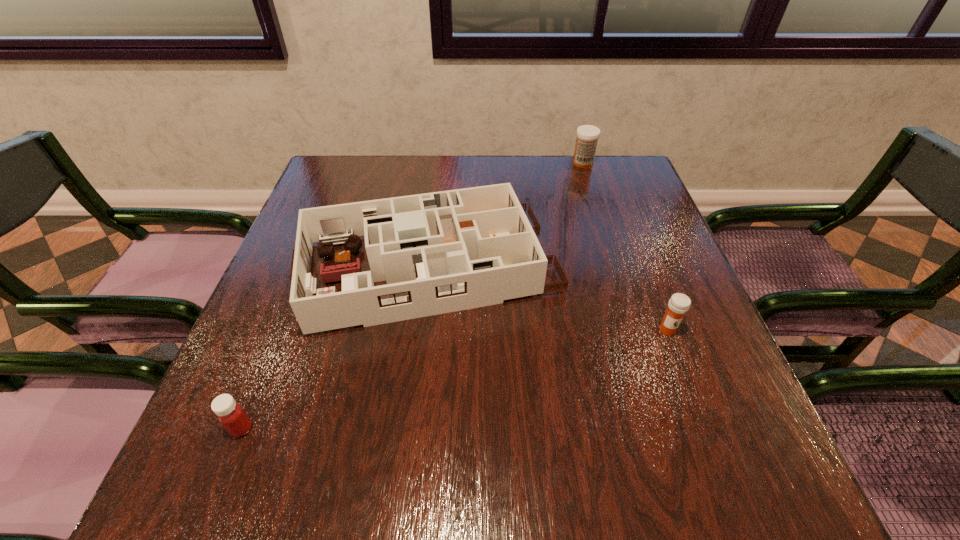
Point out which medicine is positioned as the second nearest to the rightmost medicine. Please provide its 2D coordinates. Your answer should be formatted as a tuple, i.e. [(x, y)], where the tuple contains the x and y coordinates of a point satisfying the conditions above.

[(231, 415)]

Where is `free spot that satisfies the following two spatial constraints: 1. on the back side of the second medicine from left to right; 2. on the left side of the dollhouse`? The height and width of the screenshot is (540, 960). free spot that satisfies the following two spatial constraints: 1. on the back side of the second medicine from left to right; 2. on the left side of the dollhouse is located at coordinates (441, 163).

Find the location of a particular element. This screenshot has height=540, width=960. vacant area that satisfies the following two spatial constraints: 1. on the back side of the third object from left to right; 2. on the left side of the dollhouse is located at coordinates (441, 163).

Image resolution: width=960 pixels, height=540 pixels. In order to click on vacant region that satisfies the following two spatial constraints: 1. on the back side of the dollhouse; 2. on the right side of the nearest object in this screenshot , I will do `click(306, 267)`.

Where is `vacant space that satisfies the following two spatial constraints: 1. on the back side of the leftmost medicine; 2. on the right side of the dollhouse`? vacant space that satisfies the following two spatial constraints: 1. on the back side of the leftmost medicine; 2. on the right side of the dollhouse is located at coordinates (306, 267).